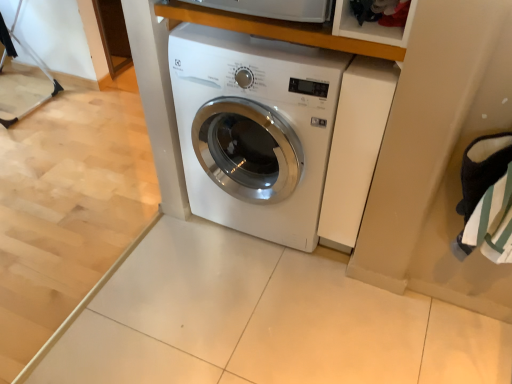
Question: Would you say white glossy washing machine at center is inside or outside wooden at upper center?

Choices:
 (A) outside
 (B) inside

Answer: (A)

Question: Is white glossy washing machine at center taller or shorter than wooden at upper center?

Choices:
 (A) short
 (B) tall

Answer: (B)

Question: In terms of size, does white glossy washing machine at center appear bigger or smaller than wooden at upper center?

Choices:
 (A) small
 (B) big

Answer: (B)

Question: Is point (271, 29) closer or farther from the camera than point (231, 54)?

Choices:
 (A) farther
 (B) closer

Answer: (B)

Question: Considering the positions of wooden at upper center and white glossy washing machine at center in the image, is wooden at upper center bigger or smaller than white glossy washing machine at center?

Choices:
 (A) big
 (B) small

Answer: (B)

Question: In terms of width, does wooden at upper center look wider or thinner when compared to white glossy washing machine at center?

Choices:
 (A) thin
 (B) wide

Answer: (A)

Question: In the image, is wooden at upper center positioned in front of or behind white glossy washing machine at center?

Choices:
 (A) front
 (B) behind

Answer: (A)